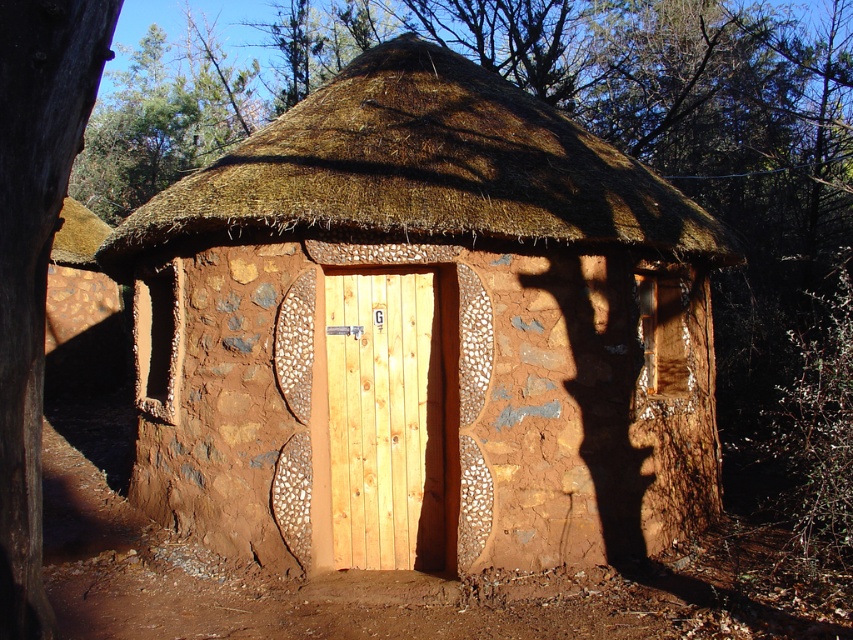
You are an architect designing a new door for the brown textured mud hut at center. The current light brown wood door at center is too narrow. How does the width of the mud hut compare to the door?

The brown textured mud hut at center is wider than the light brown wood door at center, so the new door should be designed to match the wider width of the mud hut.